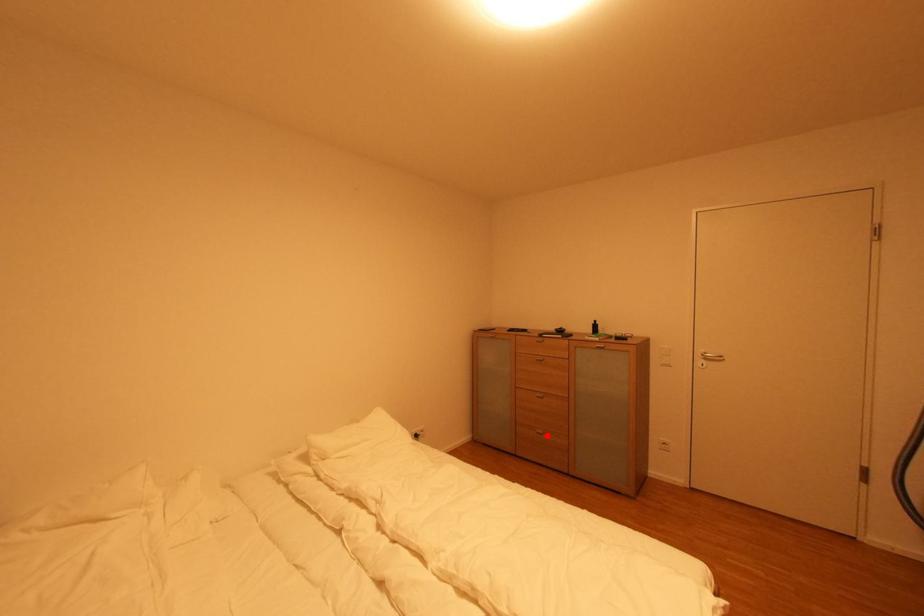
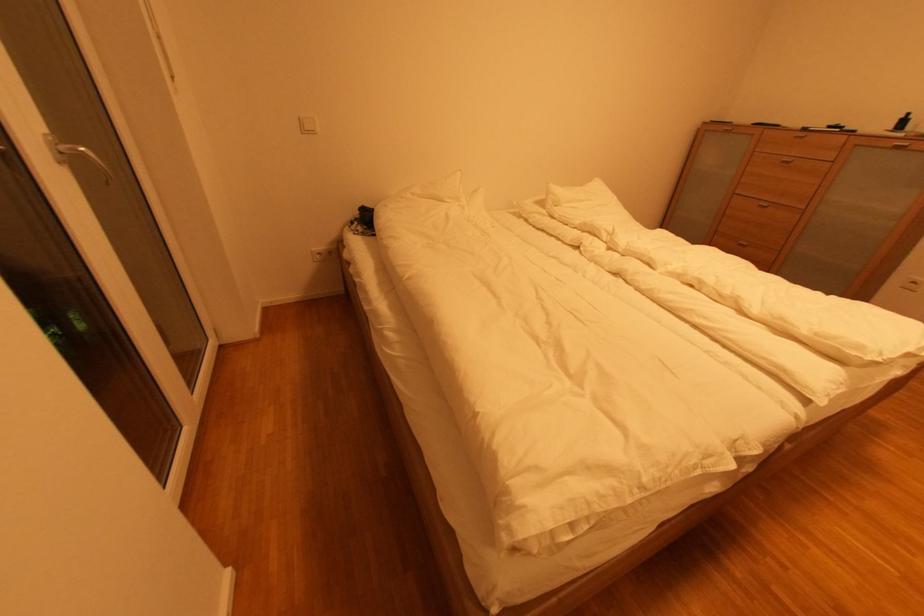
Question: I am providing you with two images of the same scene from different viewpoints. Given a red point in image1, look at the same physical point in image2. Is it:

Choices:
 (A) Closer to the viewpoint
 (B) Farther from the viewpoint

Answer: (A)